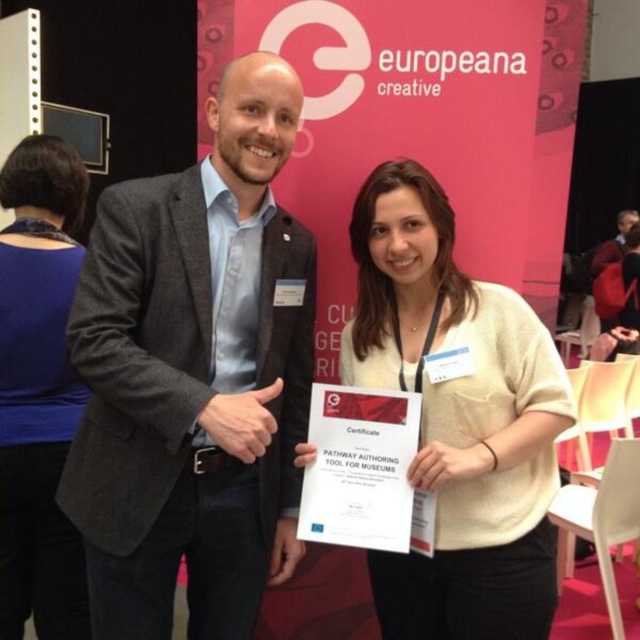
You are a photographer at an event and need to adjust the lighting between the white cotton shirt at center and the blue fabric shirt at upper left. The minimum distance required between the two shirts for the lighting setup is 3 feet. Based on the scene description, can you confirm if the current distance allows for the setup?

The white cotton shirt at center and blue fabric shirt at upper left are 3.54 feet apart, which is more than the required 3 feet, so the lighting setup can be done.

You are standing in front of the Europeana Creative backdrop and want to take a photo of the point at coordinates (294, 536). If your camera has a focal length of 50mm and you are currently 6 feet away from the backdrop, should you move closer or farther away to focus on that point?

The point at coordinates (294, 536) is 5.53 feet away from the camera. Since you are currently 6 feet away, you should move slightly closer to be within the 5.53 feet distance to focus on that point.

You are a photographer setting up for a group photo. You need to ensure that the gray woolen blazer at center and the blue fabric shirt at upper left are both visible in the frame. Based on their sizes, which one might require more space in the camera frame?

The gray woolen blazer at center might require more space in the camera frame since it is wider than the blue fabric shirt at upper left according to the description.